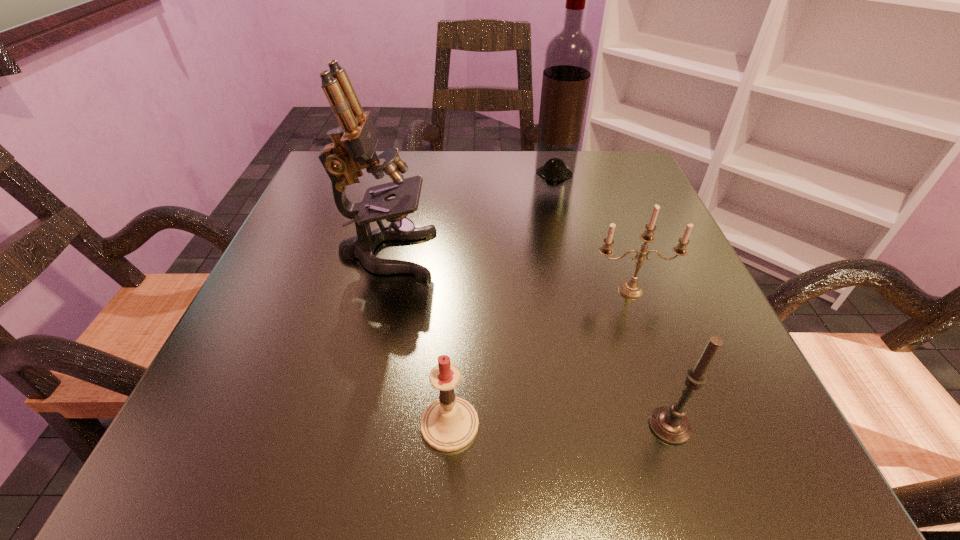
Locate an element on the screen. The height and width of the screenshot is (540, 960). the farthest object is located at coordinates (569, 55).

Find the location of a particular element. Image resolution: width=960 pixels, height=540 pixels. wine bottle is located at coordinates (569, 55).

At what (x,y) coordinates should I click in order to perform the action: click on the second farthest object. Please return your answer as a coordinate pair (x, y). The image size is (960, 540). Looking at the image, I should click on (354, 141).

Locate an element on the screen. The image size is (960, 540). microscope is located at coordinates (354, 141).

You are a GUI agent. You are given a task and a screenshot of the screen. Output one action in this format:
    pyautogui.click(x=<x>, y=<y>)
    Task: Click on the third nearest object
    The height and width of the screenshot is (540, 960).
    Given the screenshot: What is the action you would take?
    (x=630, y=289)

Find the location of a particular element. The width and height of the screenshot is (960, 540). the shortest candle is located at coordinates point(448,424).

Find the location of `the leftmost candle`. the leftmost candle is located at coordinates (448, 424).

Locate an element on the screen. This screenshot has height=540, width=960. blank space located on the left of the tallest object is located at coordinates (486, 173).

Find the location of a particular element. Image resolution: width=960 pixels, height=540 pixels. vacant area situated at the eyepieces of the leftmost object is located at coordinates (490, 254).

You are a GUI agent. You are given a task and a screenshot of the screen. Output one action in this format:
    pyautogui.click(x=<x>, y=<y>)
    Task: Click on the vacant space located 0.050m on the left of the third nearest object
    The width and height of the screenshot is (960, 540).
    Given the screenshot: What is the action you would take?
    pyautogui.click(x=560, y=291)